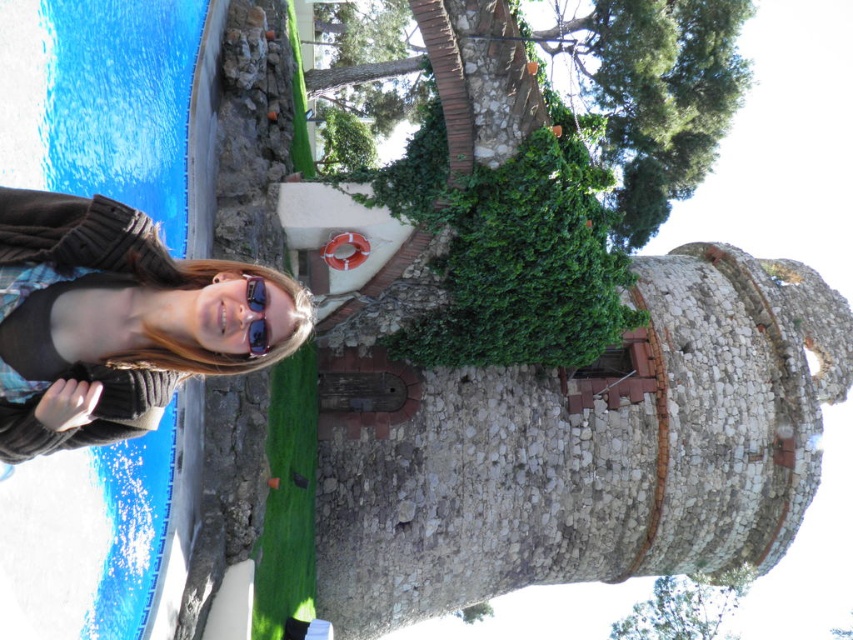
Does blue glossy pool at lower left have a greater height compared to matte brown sweater at lower left?

Yes, blue glossy pool at lower left is taller than matte brown sweater at lower left.

Does blue glossy pool at lower left appear under matte brown sweater at lower left?

No, blue glossy pool at lower left is not below matte brown sweater at lower left.

Between point (177, 16) and point (4, 276), which one is positioned behind?

Positioned behind is point (177, 16).

I want to click on blue glossy pool at lower left, so pos(102,100).

Image resolution: width=853 pixels, height=640 pixels. What do you see at coordinates (479, 77) in the screenshot?
I see `green leafy tree trunk at upper center` at bounding box center [479, 77].

Based on the photo, who is lower down, green leafy tree trunk at upper center or sunglasses at center?

sunglasses at center is lower down.

You are a GUI agent. You are given a task and a screenshot of the screen. Output one action in this format:
    pyautogui.click(x=<x>, y=<y>)
    Task: Click on the green leafy tree trunk at upper center
    Image resolution: width=853 pixels, height=640 pixels.
    Given the screenshot: What is the action you would take?
    pyautogui.click(x=479, y=77)

Where is `green leafy tree trunk at upper center`? The width and height of the screenshot is (853, 640). green leafy tree trunk at upper center is located at coordinates (479, 77).

Is point (430, 481) positioned before point (42, 0)?

No, it is not.

Can you confirm if green leafy tree trunk at center is shorter than blue glossy pool at lower left?

Indeed, green leafy tree trunk at center has a lesser height compared to blue glossy pool at lower left.

Does point (762, 321) lie in front of point (55, 593)?

No, (762, 321) is behind (55, 593).

You are a GUI agent. You are given a task and a screenshot of the screen. Output one action in this format:
    pyautogui.click(x=<x>, y=<y>)
    Task: Click on the green leafy tree trunk at center
    
    Given the screenshot: What is the action you would take?
    pyautogui.click(x=589, y=451)